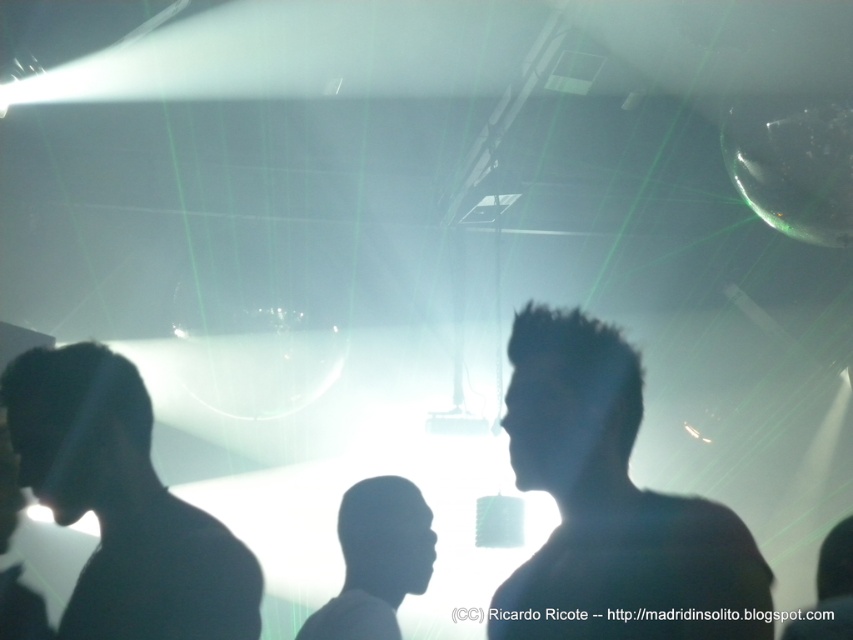
You are standing in the nightclub and want to move from the point closer to you to the point further away. Which path should you take between the two points, point (668, 614) and point (311, 624)?

You should move from point (668, 614) to point (311, 624) because point (668, 614) is closer to the viewer, and you want to go to the point further away.

You are a photographer trying to capture a clear shot of the silhouette hair at center and the black matte head at left. Since both are backlit, you want to adjust your camera settings to ensure neither is overexposed. Given their sizes, which object should you prioritize focusing on to avoid overexposure?

The silhouette hair at center has a lesser width compared to the black matte head at left, so you should prioritize focusing on the silhouette hair at center to avoid overexposure since it is smaller and might require more precise adjustment.